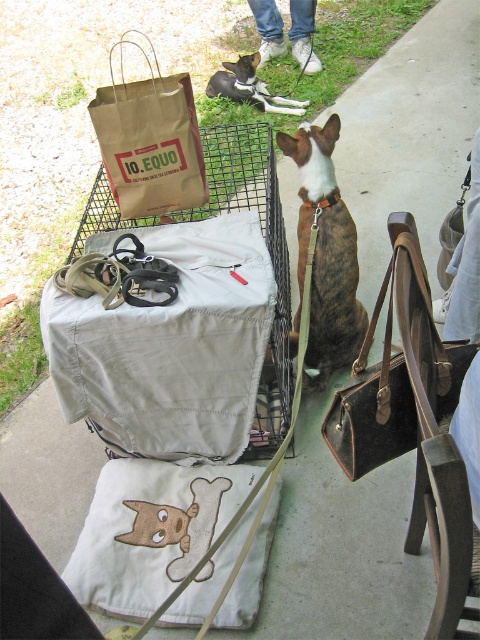
Does brown leather dog at center have a lesser width compared to black and white fur at center?

Indeed, brown leather dog at center has a lesser width compared to black and white fur at center.

Can you confirm if brown leather dog at center is shorter than black and white fur at center?

No, brown leather dog at center is not shorter than black and white fur at center.

What do you see at coordinates (325, 253) in the screenshot? I see `brown leather dog at center` at bounding box center [325, 253].

This screenshot has height=640, width=480. What are the coordinates of `brown leather dog at center` in the screenshot? It's located at (325, 253).

Does brown paper bag at upper left have a larger size compared to black and white fur at center?

No, brown paper bag at upper left is not bigger than black and white fur at center.

Who is taller, brown paper bag at upper left or black and white fur at center?

brown paper bag at upper left

Measure the distance between point (x=155, y=196) and camera.

Point (x=155, y=196) is 1.82 meters from camera.

Image resolution: width=480 pixels, height=640 pixels. What are the coordinates of `brown paper bag at upper left` in the screenshot? It's located at (149, 141).

Is matte black leash at center taller than brown paper bag at upper left?

Yes.

Is matte black leash at center smaller than brown paper bag at upper left?

Incorrect, matte black leash at center is not smaller in size than brown paper bag at upper left.

This screenshot has width=480, height=640. Describe the element at coordinates (171, 346) in the screenshot. I see `matte black leash at center` at that location.

Identify the location of matte black leash at center. (171, 346).